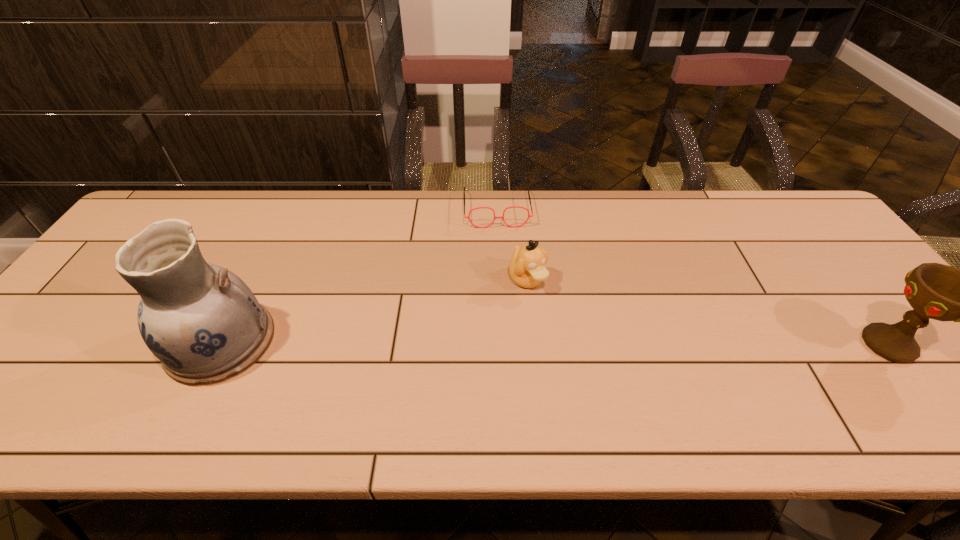
Identify the location of vacant space located on the face of the duckling. (612, 383).

This screenshot has height=540, width=960. In order to click on vacant region located 0.130m on the face of the duckling in this screenshot , I will do `click(568, 331)`.

This screenshot has height=540, width=960. I want to click on free point located 0.240m on the face of the duckling, so click(x=597, y=366).

This screenshot has width=960, height=540. I want to click on blank space located 0.350m on the front-facing side of the spectacles, so pos(508,320).

Find the location of a particular element. This screenshot has height=540, width=960. vacant space situated 0.350m on the front-facing side of the spectacles is located at coordinates (508, 320).

The height and width of the screenshot is (540, 960). In order to click on free space located 0.320m on the front-facing side of the spectacles in this screenshot , I will do `click(507, 311)`.

Identify the location of object at the far edge. (468, 217).

Find the location of a particular element. This screenshot has height=540, width=960. pottery present at the near edge is located at coordinates (205, 325).

I want to click on chalice situated at the near edge, so click(936, 291).

At what (x,y) coordinates should I click in order to perform the action: click on object that is at the right edge. Please return your answer as a coordinate pair (x, y). The width and height of the screenshot is (960, 540). Looking at the image, I should click on (936, 291).